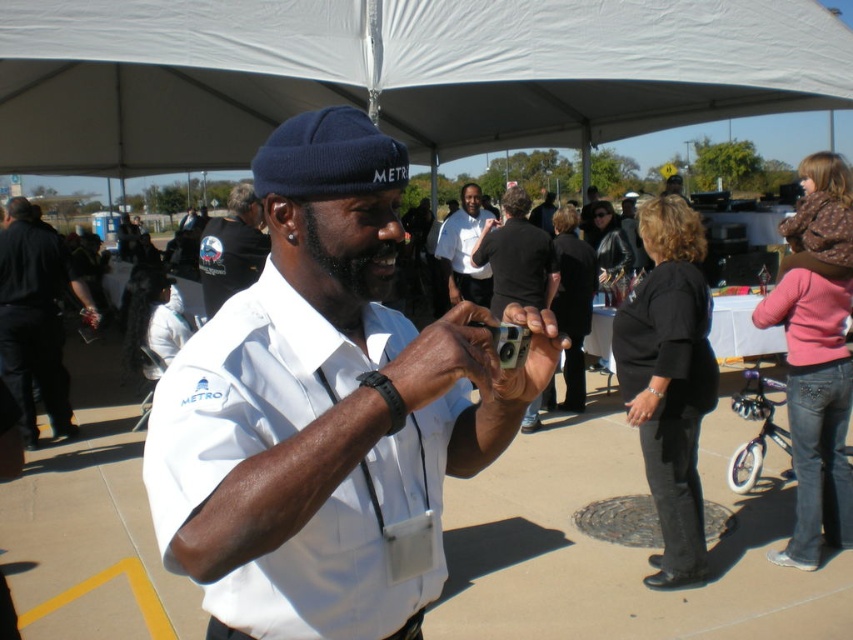
Image resolution: width=853 pixels, height=640 pixels. I want to click on white matte uniform at center, so click(x=325, y=406).

Where is `white matte uniform at center`? white matte uniform at center is located at coordinates (325, 406).

Who is higher up, white matte uniform at center or metallic gray camera at center?

metallic gray camera at center is higher up.

You are a GUI agent. You are given a task and a screenshot of the screen. Output one action in this format:
    pyautogui.click(x=<x>, y=<y>)
    Task: Click on the white matte uniform at center
    This screenshot has width=853, height=640.
    Given the screenshot: What is the action you would take?
    pyautogui.click(x=325, y=406)

Is point (463, 344) farther from viewer compared to point (593, 125)?

No, (463, 344) is closer to viewer.

Does white matte uniform at center have a larger size compared to white fabric canopy at upper center?

Actually, white matte uniform at center might be smaller than white fabric canopy at upper center.

You are a GUI agent. You are given a task and a screenshot of the screen. Output one action in this format:
    pyautogui.click(x=<x>, y=<y>)
    Task: Click on the white matte uniform at center
    
    Given the screenshot: What is the action you would take?
    pyautogui.click(x=325, y=406)